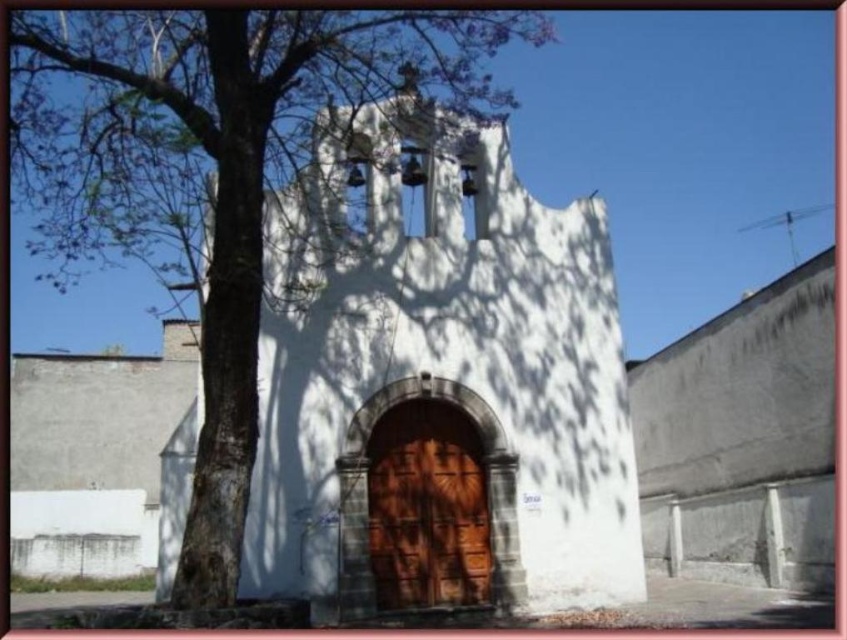
Is point (97, 12) closer to camera compared to point (490, 561)?

No, it is behind (490, 561).

Does green leafy tree at left have a lesser width compared to brown wooden door at center?

No.

This screenshot has width=847, height=640. Identify the location of green leafy tree at left. (219, 170).

Identify the location of green leafy tree at left. (219, 170).